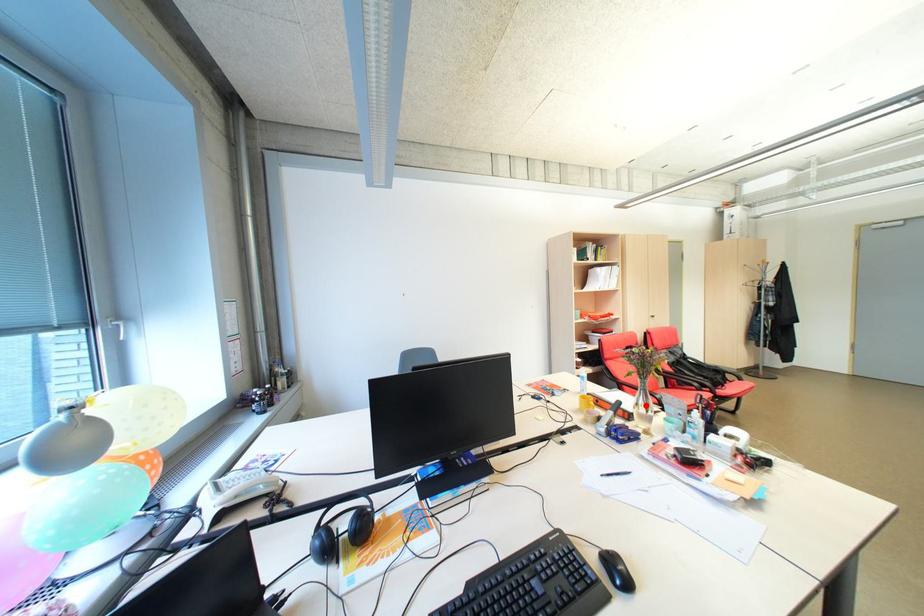
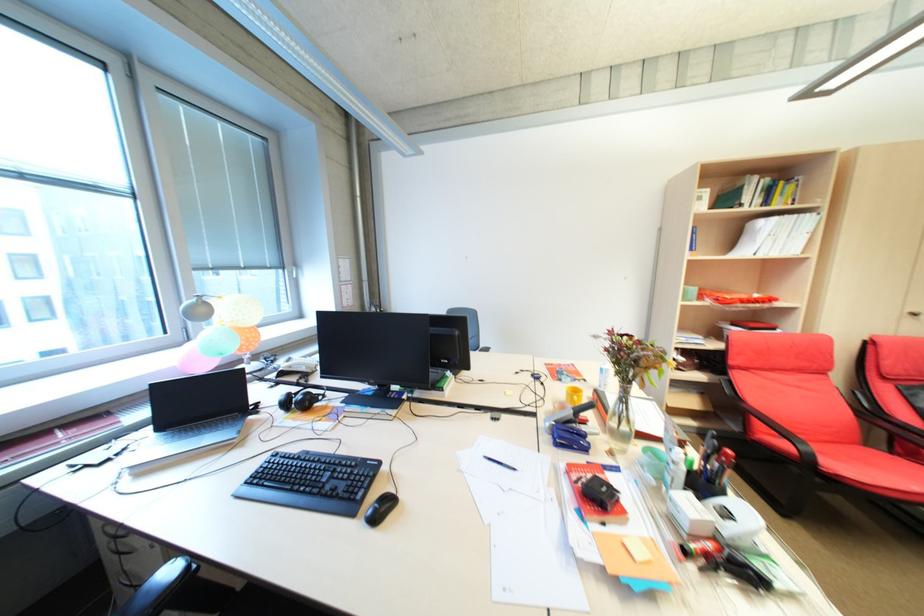
Question: I am providing you with two images of the same scene from different viewpoints. In image1, a red point is highlighted. Considering the same 3D point in image2, which of the following is correct?

Choices:
 (A) It is closer
 (B) It is farther

Answer: (B)